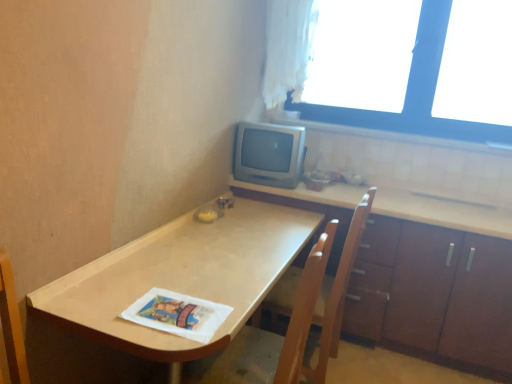
Where is `vacant area that lies to the right of wooden chair at center`? The width and height of the screenshot is (512, 384). vacant area that lies to the right of wooden chair at center is located at coordinates (371, 367).